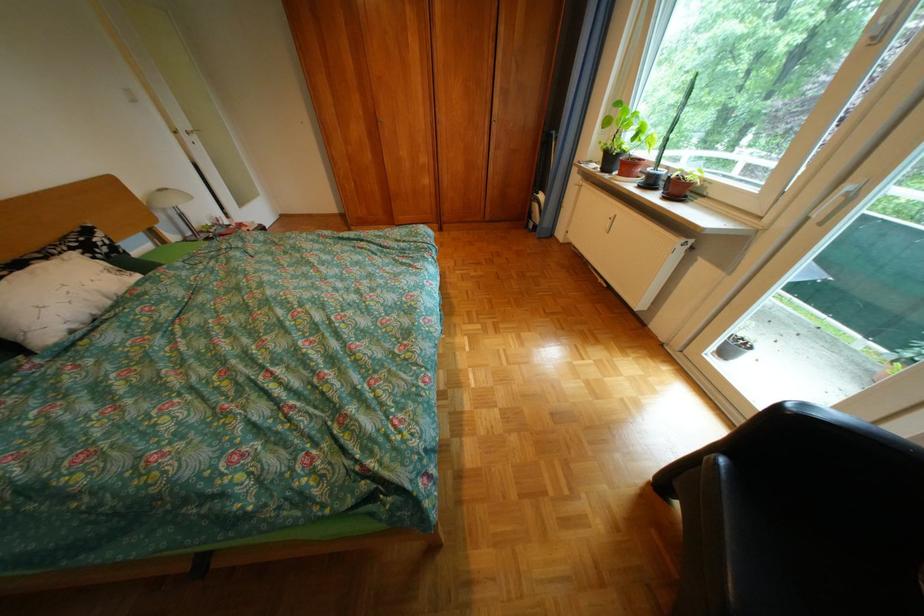
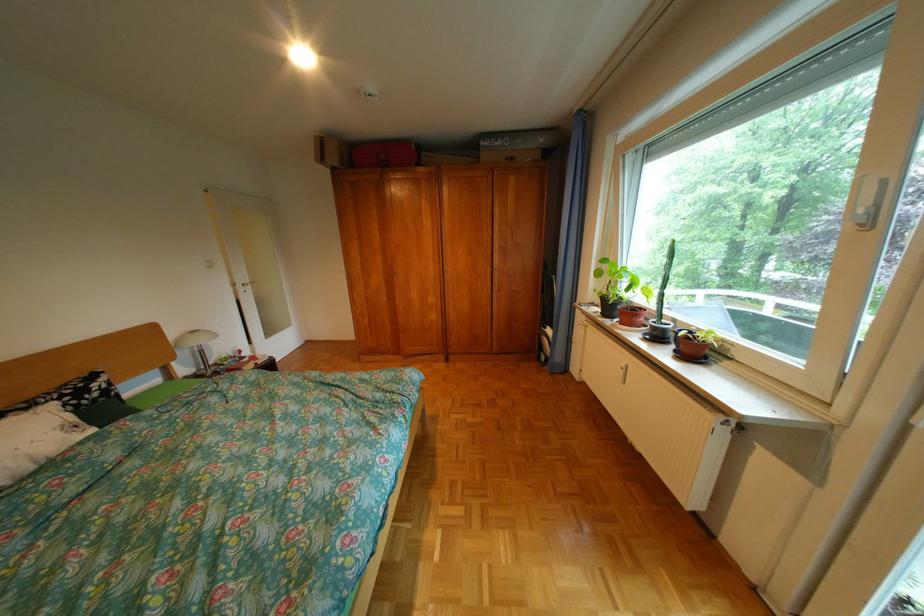
Question: Based on the continuous images, in which direction is the camera rotating? Reply with the corresponding letter.

Choices:
 (A) Left
 (B) Right
 (C) Up
 (D) Down

Answer: (C)